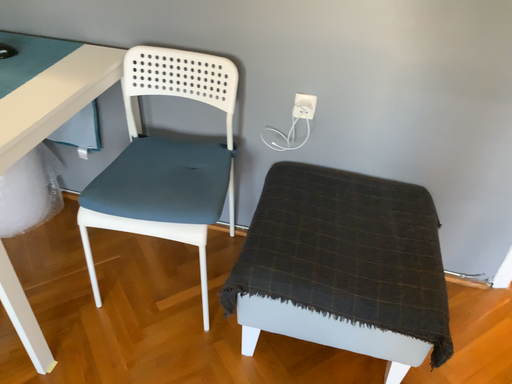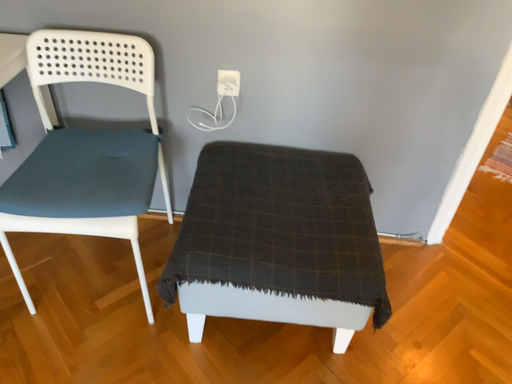
Question: How did the camera likely rotate when shooting the video?

Choices:
 (A) rotated right
 (B) rotated left

Answer: (A)